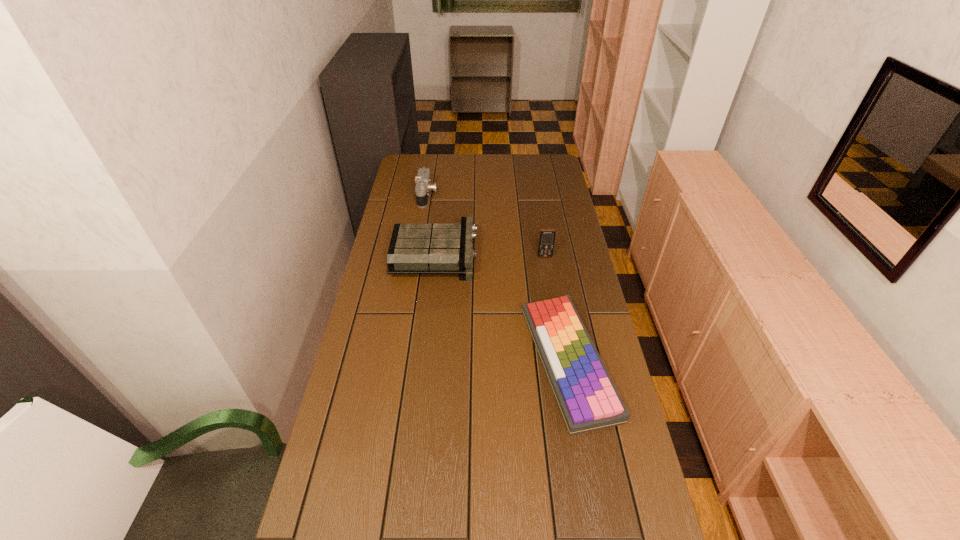
Find the location of `cellular telephone`. cellular telephone is located at coordinates (547, 236).

Identify the location of the farthest object. This screenshot has height=540, width=960. (423, 187).

Where is `radio receiver`? radio receiver is located at coordinates (414, 248).

At what (x,y) coordinates should I click in order to perform the action: click on the shortest object. Please return your answer as a coordinate pair (x, y). The image size is (960, 540). Looking at the image, I should click on (588, 400).

The image size is (960, 540). Find the location of `computer keyboard`. computer keyboard is located at coordinates (588, 400).

I want to click on vacant area situated on the screen of the tallest object, so click(x=552, y=298).

The width and height of the screenshot is (960, 540). In order to click on blank area located on the lens of the camera in this screenshot , I will do `click(487, 195)`.

Image resolution: width=960 pixels, height=540 pixels. Identify the location of free space located on the front panel of the radio receiver. (495, 256).

You are a GUI agent. You are given a task and a screenshot of the screen. Output one action in this format:
    pyautogui.click(x=<x>, y=<y>)
    Task: Click on the free space located on the back of the computer keyboard
    
    Given the screenshot: What is the action you would take?
    pyautogui.click(x=549, y=252)

Where is `camera that is positioned at the left edge`? camera that is positioned at the left edge is located at coordinates (423, 187).